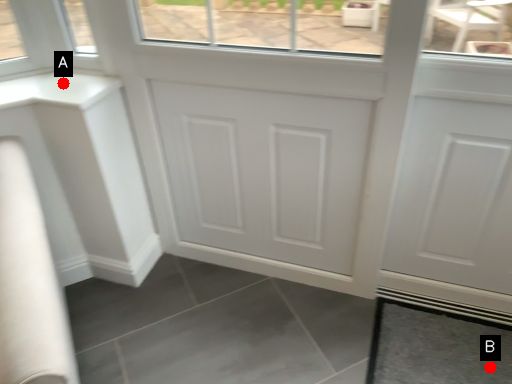
Question: Two points are circled on the image, labeled by A and B beside each circle. Which point is closer to the camera?

Choices:
 (A) A is closer
 (B) B is closer

Answer: (A)